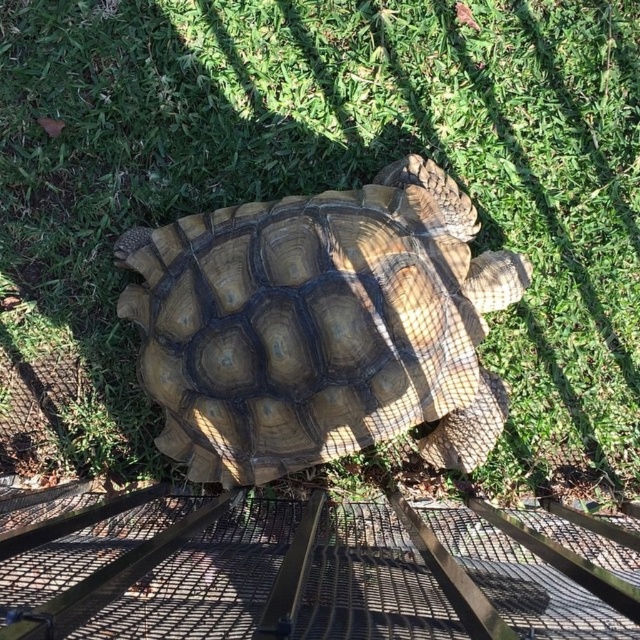
You are a researcher studying the positioning of the brown textured shell at center in the image. Based on the coordinates provided, can you determine if the shell is positioned closer to the top or bottom of the image?

The brown textured shell at center is located at point coordinates of 0.511 on the vertical axis. Since the vertical axis ranges from 0 at the bottom to 1 at the top, a value of 0.511 means it is slightly above the midpoint, so it is closer to the top of the image.

You are standing in a grassy area and see a large tortoise. The coordinates of the point where the brown textured shell at center is located are given. If you want to touch the shell, should you move towards the point at coordinates point (321,326)?

Yes, you should move towards the point at coordinates point (321,326) because that is where the brown textured shell at center is located.